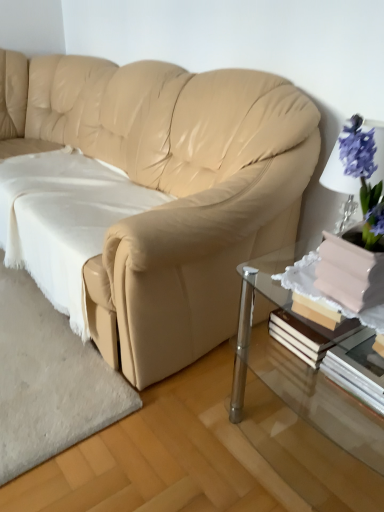
In order to face beige leather couch at center, should I rotate leftwards or rightwards?

It's best to rotate left around 18.929 degrees.

Identify the location of white soft fabric at lower left. (63, 220).

What do you see at coordinates (315, 399) in the screenshot? I see `clear glass table at lower right` at bounding box center [315, 399].

Consider the image. Measure the distance between point [375,395] and camera.

The distance of point [375,395] from camera is 36.26 inches.

Image resolution: width=384 pixels, height=512 pixels. What do you see at coordinates (324, 357) in the screenshot?
I see `white paper book at lower right` at bounding box center [324, 357].

You are a GUI agent. You are given a task and a screenshot of the screen. Output one action in this format:
    pyautogui.click(x=<x>, y=<y>)
    Task: Click on the beige leather couch at center
    
    Given the screenshot: What is the action you would take?
    pyautogui.click(x=152, y=199)

Is beige leather couch at center surrounded by white soft fabric at lower left?

Definitely not — beige leather couch at center is not inside white soft fabric at lower left.

From the image's perspective, is white soft fabric at lower left beneath beige leather couch at center?

Yes.

Which is in front, white soft fabric at lower left or beige leather couch at center?

Positioned in front is beige leather couch at center.

Which of these two, white soft fabric at lower left or clear glass table at lower right, is bigger?

With larger size is white soft fabric at lower left.

Consider the image. Is white soft fabric at lower left not close to clear glass table at lower right?

Actually, white soft fabric at lower left and clear glass table at lower right are a little close together.

From the image's perspective, is white soft fabric at lower left above clear glass table at lower right?

Indeed, from the image's perspective, white soft fabric at lower left is shown above clear glass table at lower right.

Which is closer, (102,204) or (256,330)?

Point (102,204) is positioned farther from the camera compared to point (256,330).

Find the location of a particular element. book located on the right of white soft fabric at lower left is located at coordinates (324, 357).

Is white paper book at lower right not close to white soft fabric at lower left?

No.

Is white paper book at lower right aimed at white soft fabric at lower left?

No, white paper book at lower right is not aimed at white soft fabric at lower left.

From a real-world perspective, who is located lower, white paper book at lower right or white soft fabric at lower left?

white soft fabric at lower left, from a real-world perspective.

From a real-world perspective, is beige leather couch at center on white soft fabric at lower left?

Correct, in the physical world, beige leather couch at center is higher than white soft fabric at lower left.

Where is `sheet behind the beige leather couch at center`? The height and width of the screenshot is (512, 384). sheet behind the beige leather couch at center is located at coordinates 63,220.

Is beige leather couch at center looking in the opposite direction of white soft fabric at lower left?

Correct, beige leather couch at center is looking away from white soft fabric at lower left.

From a real-world perspective, which is physically below, clear glass table at lower right or beige leather couch at center?

clear glass table at lower right, from a real-world perspective.

Would you say clear glass table at lower right is to the left or to the right of beige leather couch at center in the picture?

clear glass table at lower right is positioned on beige leather couch at center's right side.

In the scene shown: Is beige leather couch at center located within clear glass table at lower right?

Definitely not — beige leather couch at center is not inside clear glass table at lower right.

Is there a large distance between clear glass table at lower right and white paper book at lower right?

No.

Considering the positions of objects clear glass table at lower right and white paper book at lower right in the image provided, who is more to the right, clear glass table at lower right or white paper book at lower right?

Positioned to the right is white paper book at lower right.

From a real-world perspective, is clear glass table at lower right physically below white paper book at lower right?

Yes.

From the image's perspective, between clear glass table at lower right and white paper book at lower right, who is located below?

clear glass table at lower right appears lower in the image.

Based on the photo, is white paper book at lower right bigger or smaller than beige leather couch at center?

In the image, white paper book at lower right appears to be smaller than beige leather couch at center.

Between white paper book at lower right and beige leather couch at center, which one appears on the left side from the viewer's perspective?

Positioned to the left is beige leather couch at center.

Looking at this image, from a real-world perspective, is white paper book at lower right above or below beige leather couch at center?

From a real-world perspective, white paper book at lower right is physically below beige leather couch at center.

Where is `sheet located underneath the beige leather couch at center (from a real-world perspective)`? sheet located underneath the beige leather couch at center (from a real-world perspective) is located at coordinates (63, 220).

The width and height of the screenshot is (384, 512). What are the coordinates of `sheet behind the clear glass table at lower right` in the screenshot? It's located at (63, 220).

Based on their spatial positions, is beige leather couch at center or clear glass table at lower right closer to white paper book at lower right?

Based on the image, clear glass table at lower right appears to be nearer to white paper book at lower right.

Looking at the image, which one is located closer to white soft fabric at lower left, white paper book at lower right or clear glass table at lower right?

clear glass table at lower right is closer to white soft fabric at lower left.

Looking at the image, which one is located further to white paper book at lower right, white soft fabric at lower left or clear glass table at lower right?

white soft fabric at lower left is further to white paper book at lower right.

Based on their spatial positions, is white soft fabric at lower left or white paper book at lower right closer to clear glass table at lower right?

Based on the image, white paper book at lower right appears to be nearer to clear glass table at lower right.

When comparing their distances from beige leather couch at center, does white soft fabric at lower left or clear glass table at lower right seem further?

clear glass table at lower right.

When comparing their distances from white paper book at lower right, does beige leather couch at center or white soft fabric at lower left seem closer?

beige leather couch at center lies closer to white paper book at lower right than the other object.

From the image, which object appears to be nearer to white soft fabric at lower left, beige leather couch at center or white paper book at lower right?

beige leather couch at center.

Consider the image. When comparing their distances from beige leather couch at center, does white soft fabric at lower left or white paper book at lower right seem closer?

Among the two, white soft fabric at lower left is located nearer to beige leather couch at center.

Identify the location of table between white soft fabric at lower left and white paper book at lower right. The height and width of the screenshot is (512, 384). (315, 399).

Identify the location of table between beige leather couch at center and white paper book at lower right from left to right. (315, 399).

Find the location of a particular element. sheet situated between beige leather couch at center and white paper book at lower right from left to right is located at coordinates (63, 220).

Locate an element on the screen. The width and height of the screenshot is (384, 512). sheet located between beige leather couch at center and clear glass table at lower right in the left-right direction is located at coordinates (63, 220).